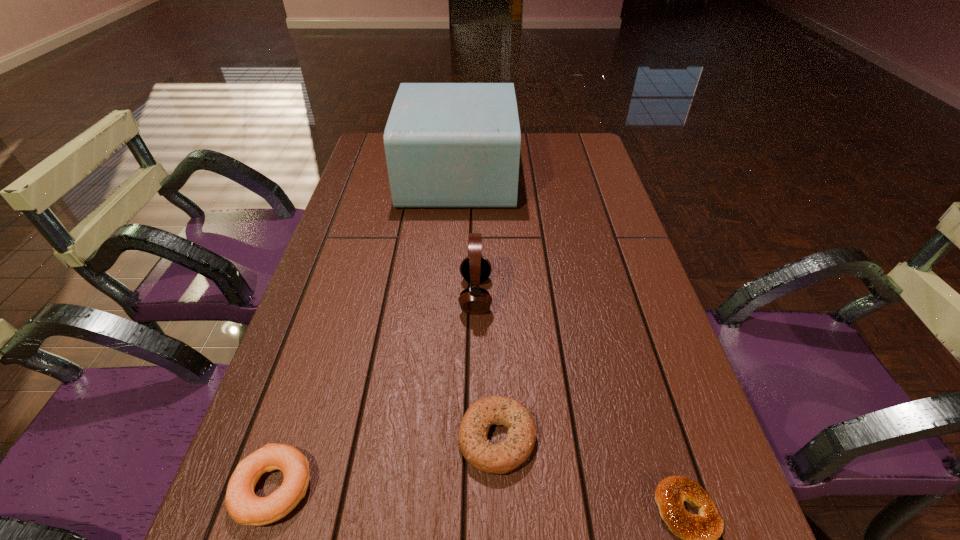
At what (x,y) coordinates should I click in order to perform the action: click on empty space that is in between the headset and the radio receiver. Please return your answer as a coordinate pair (x, y). This screenshot has width=960, height=540. Looking at the image, I should click on (467, 235).

Where is `unoccupied position between the tallest object and the leftmost bagel`? unoccupied position between the tallest object and the leftmost bagel is located at coordinates [x=366, y=332].

Locate an element on the screen. free area in between the radio receiver and the headset is located at coordinates (467, 235).

Find the location of a particular element. Image resolution: width=960 pixels, height=540 pixels. free area in between the radio receiver and the headset is located at coordinates (467, 235).

I want to click on vacant point located between the second bagel from left to right and the leftmost object, so click(385, 463).

You are a GUI agent. You are given a task and a screenshot of the screen. Output one action in this format:
    pyautogui.click(x=<x>, y=<y>)
    Task: Click on the closest object to the leftmost bagel
    This screenshot has height=540, width=960.
    Given the screenshot: What is the action you would take?
    pyautogui.click(x=500, y=458)

Locate which object is the fourth closest to the leftmost object. Please provide its 2D coordinates. Your answer should be formatted as a tuple, i.e. [(x, y)], where the tuple contains the x and y coordinates of a point satisfying the conditions above.

[(448, 145)]

Find the location of a particular element. This screenshot has width=960, height=540. bagel object that ranks as the second closest to the leftmost bagel is located at coordinates (700, 532).

Identify which bagel is the closest to the rightmost bagel. Please provide its 2D coordinates. Your answer should be formatted as a tuple, i.e. [(x, y)], where the tuple contains the x and y coordinates of a point satisfying the conditions above.

[(500, 458)]

Image resolution: width=960 pixels, height=540 pixels. I want to click on vacant space that satisfies the following two spatial constraints: 1. on the ear pads of the second tallest object; 2. on the front side of the leftmost bagel, so click(x=473, y=488).